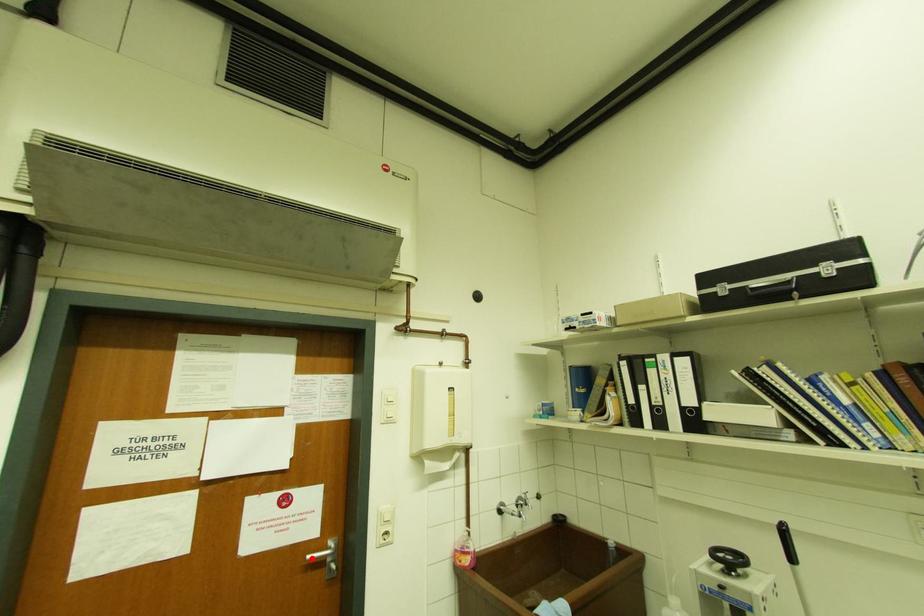
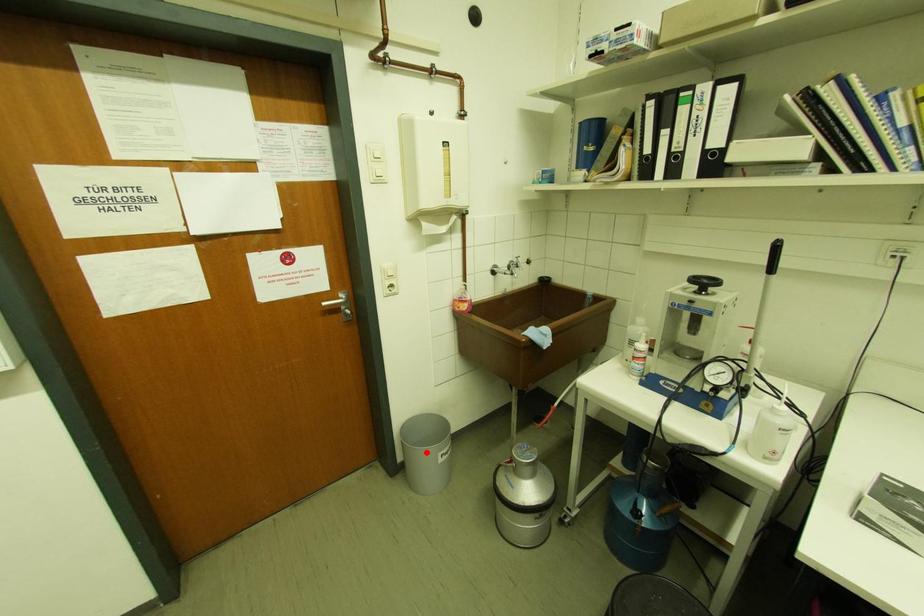
I am providing you with two images of the same scene from different viewpoints. A red point is marked on the first image and another point is marked on the second image. Do the highlighted points in image1 and image2 indicate the same real-world spot?

No